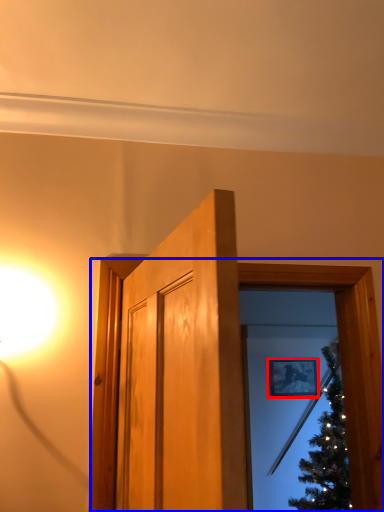
Question: Which point is further to the camera, picture frame (highlighted by a red box) or window frame (highlighted by a blue box)?

Choices:
 (A) picture frame
 (B) window frame

Answer: (A)